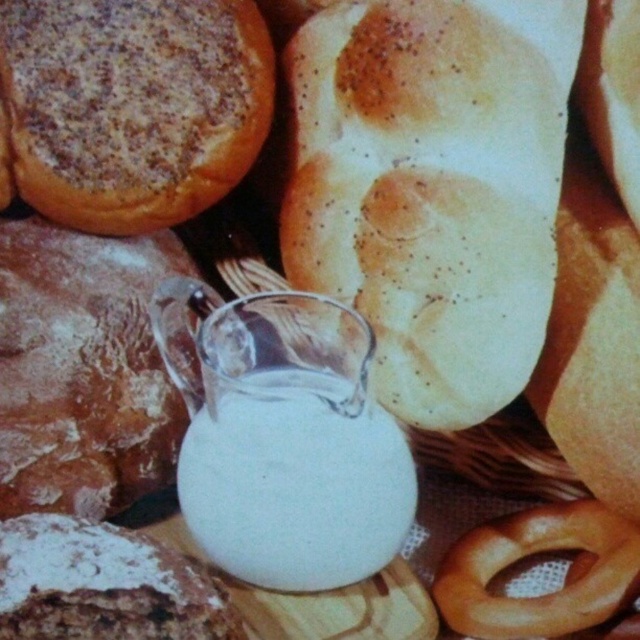
From the picture: Is the position of golden crusty bread at center more distant than that of white opaque jug at center?

Yes, it is.

Which is behind, point (426, 131) or point (310, 518)?

Point (426, 131)

Does point (468, 241) come in front of point (336, 428)?

No, it is behind (336, 428).

Locate an element on the screen. golden crusty bread at center is located at coordinates (433, 188).

Between white floury bread at center and golden brown pretzel at center, which one has more height?

white floury bread at center

Which is above, white floury bread at center or golden brown pretzel at center?

Positioned higher is white floury bread at center.

At what (x,y) coordinates should I click in order to perform the action: click on white floury bread at center. Please return your answer as a coordinate pair (x, y). This screenshot has width=640, height=640. Looking at the image, I should click on (83, 369).

Consider the image. Does powdery white cake at lower left appear under golden brown pretzel at center?

Incorrect, powdery white cake at lower left is not positioned below golden brown pretzel at center.

Measure the distance between powdery white cake at lower left and golden brown pretzel at center.

The distance of powdery white cake at lower left from golden brown pretzel at center is 20.84 centimeters.

Locate an element on the screen. powdery white cake at lower left is located at coordinates (102, 584).

Where is `powdery white cake at lower left`? This screenshot has width=640, height=640. powdery white cake at lower left is located at coordinates (102, 584).